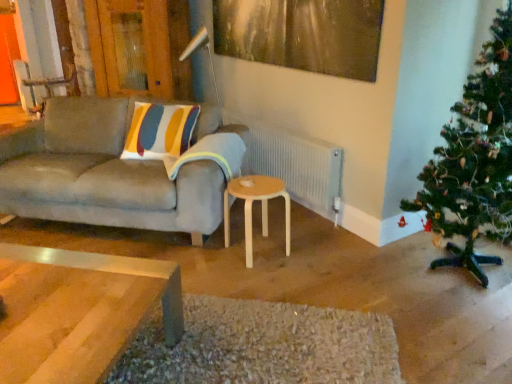
Where is `blank space to the left of green textured christmas tree at right`? This screenshot has width=512, height=384. blank space to the left of green textured christmas tree at right is located at coordinates (365, 279).